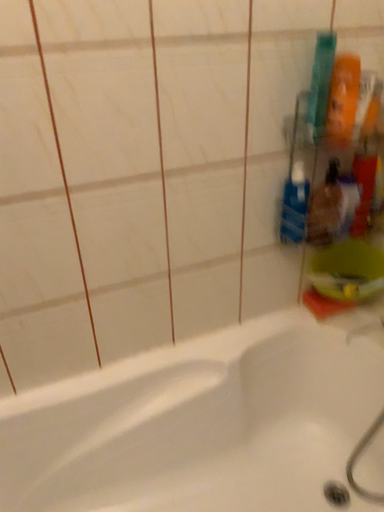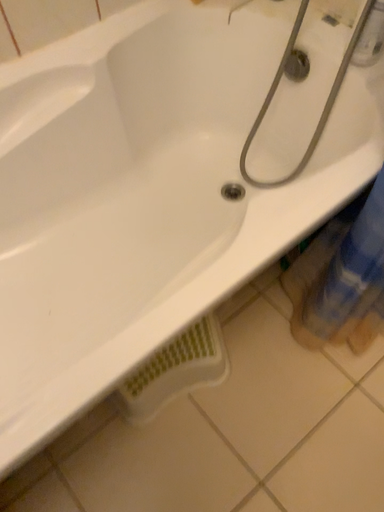
Question: How did the camera likely rotate when shooting the video?

Choices:
 (A) rotated downward
 (B) rotated upward

Answer: (A)